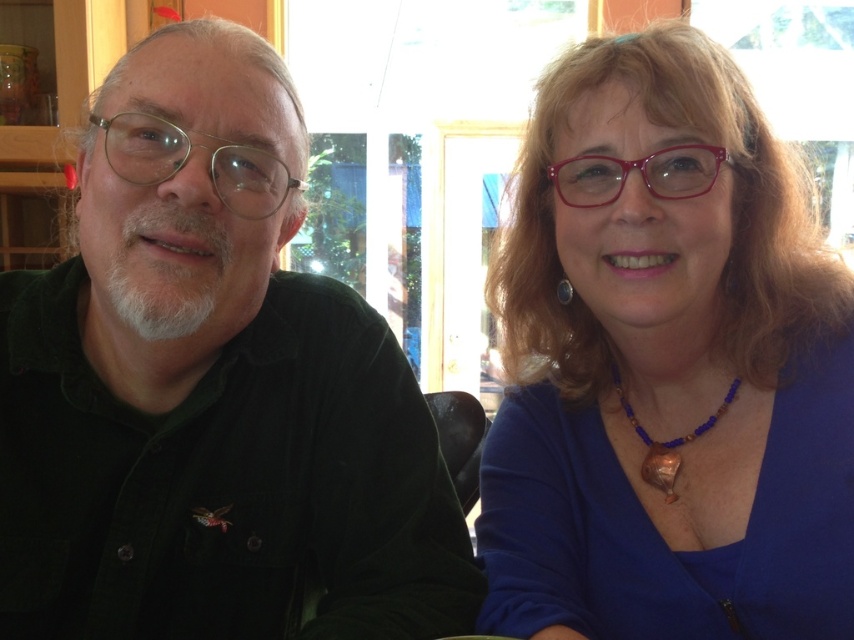
You are a photographer setting up for a portrait. You need to position a spotlight so it illuminates both the dark green corduroy shirt at left and the blue fabric shirt at upper right equally. Given their height difference, where should you place the spotlight?

A: The dark green corduroy shirt at left is taller than the blue fabric shirt at upper right, so the spotlight should be placed lower to ensure both shirts receive equal illumination.

You are taking a photo of two people sitting in a cozy indoor setting. You notice two points in the image labeled as point (127,563) and point (544,360). Which point is closer to your camera lens?

Point (127,563) is closer to the camera lens than point (544,360).